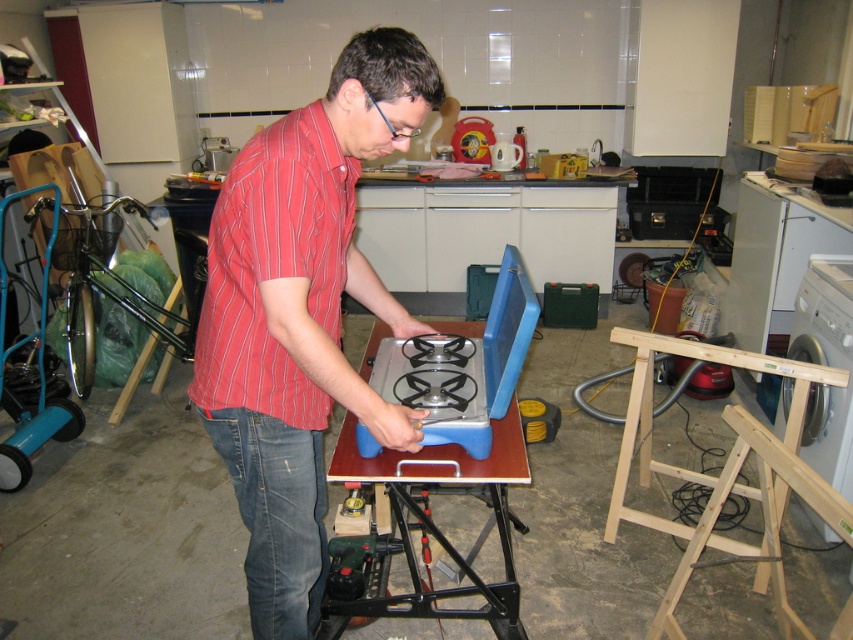
You are organizing the workshop and need to place a new tool box that is 1 meter wide. You have two options for placement areas, the blue plastic table at center and the denim at left. Which area can accommodate the tool box based on their widths?

The blue plastic table at center might be wider than denim at left, so it is more likely to accommodate the 1 meter wide tool box compared to the denim at left.

What is the 2D coordinate of the denim at left?

The 2D coordinate of the denim at left is at point (276, 516).